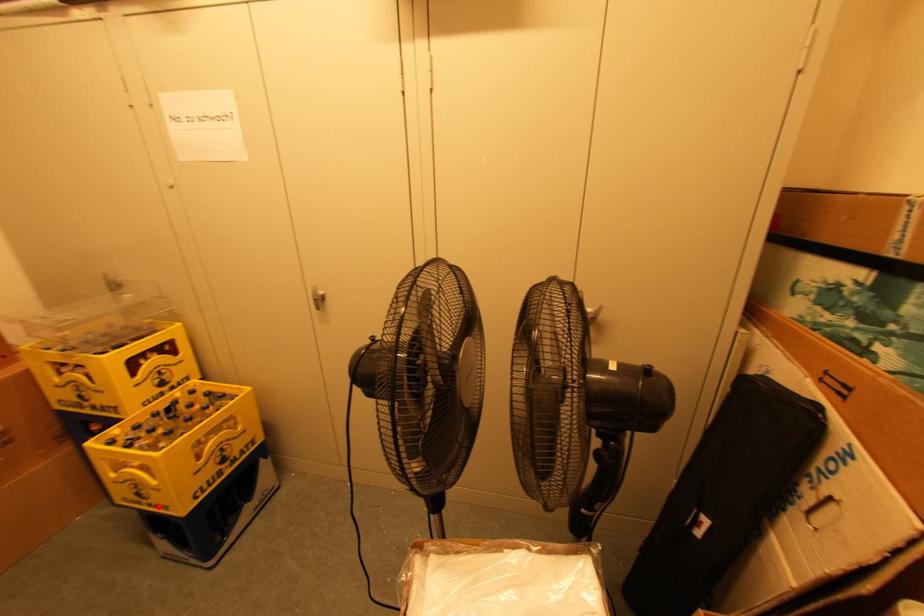
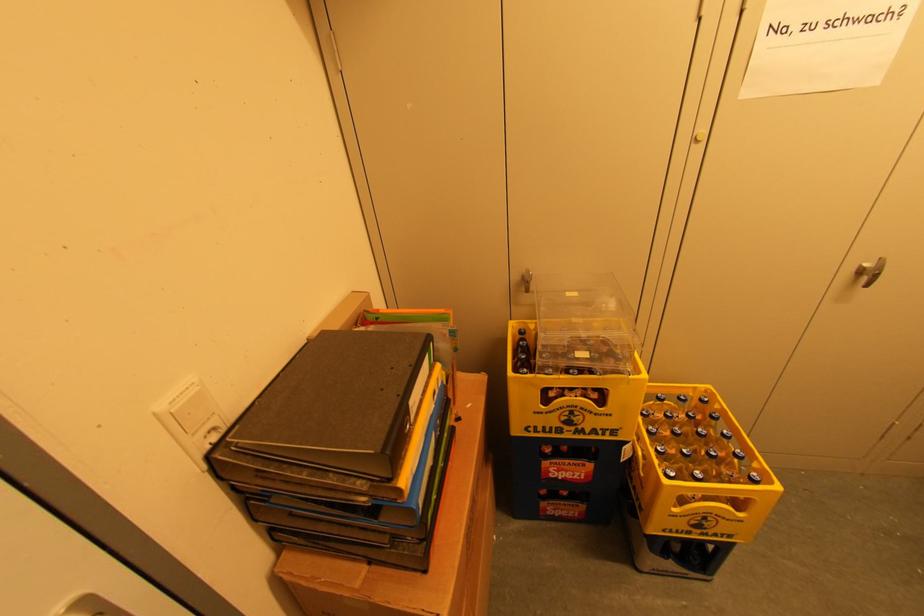
Find the pixel in the second image that matches the highlighted location in the first image.

(718, 535)